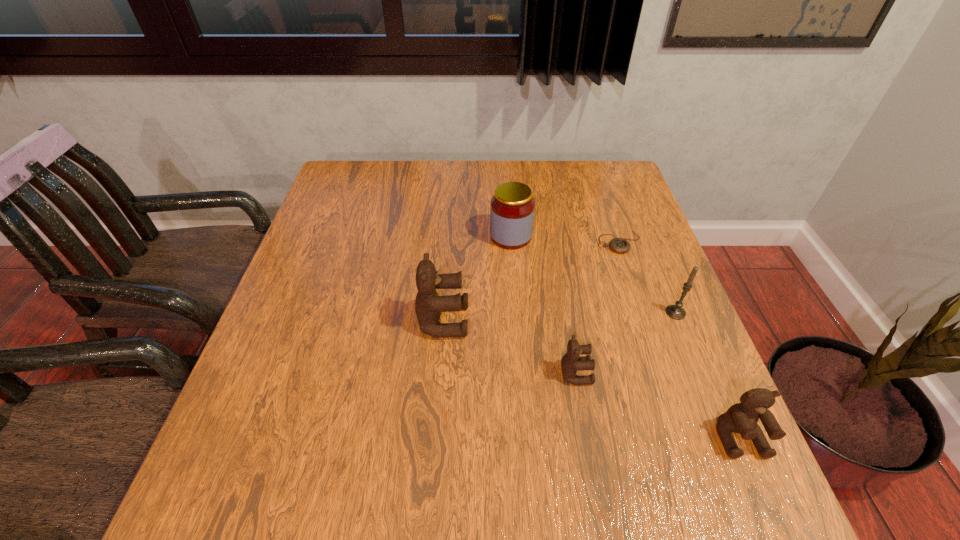
Find the location of a particular element. the leftmost teddy bear is located at coordinates (428, 304).

At what (x,y) coordinates should I click in order to perform the action: click on the leftmost object. Please return your answer as a coordinate pair (x, y). This screenshot has height=540, width=960. Looking at the image, I should click on point(428,304).

At what (x,y) coordinates should I click in order to perform the action: click on the second shortest object. Please return your answer as a coordinate pair (x, y). This screenshot has width=960, height=540. Looking at the image, I should click on (571, 362).

The image size is (960, 540). What are the coordinates of `the third object from left to right` in the screenshot? It's located at (571, 362).

This screenshot has height=540, width=960. Identify the location of the rightmost teddy bear. click(x=742, y=418).

Locate an element on the screen. The image size is (960, 540). the nearest object is located at coordinates (742, 418).

You are a GUI agent. You are given a task and a screenshot of the screen. Output one action in this format:
    pyautogui.click(x=<x>, y=<y>)
    Task: Click on the jar
    Image resolution: width=960 pixels, height=540 pixels.
    Given the screenshot: What is the action you would take?
    pyautogui.click(x=512, y=208)

This screenshot has width=960, height=540. Identify the location of pocket watch. (619, 245).

The image size is (960, 540). In order to click on candle in this screenshot , I will do `click(676, 312)`.

Identify the location of vacant space located on the face of the tallest object. (598, 321).